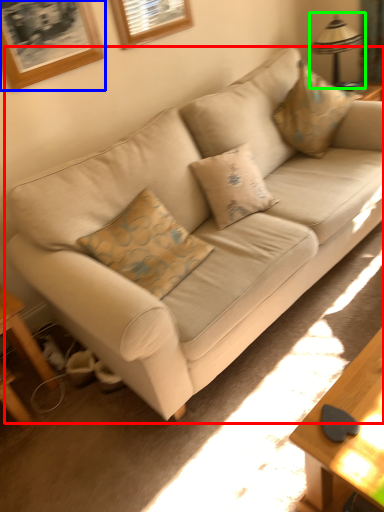
Question: Which object is positioned closest to studio couch (highlighted by a red box)? Select from picture frame (highlighted by a blue box) and table lamp (highlighted by a green box).

Choices:
 (A) picture frame
 (B) table lamp

Answer: (A)